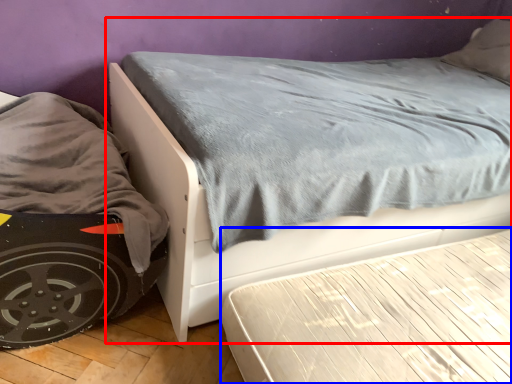
Question: Which of the following is the closest to the observer, bed (highlighted by a red box) or bed frame (highlighted by a blue box)?

Choices:
 (A) bed
 (B) bed frame

Answer: (A)